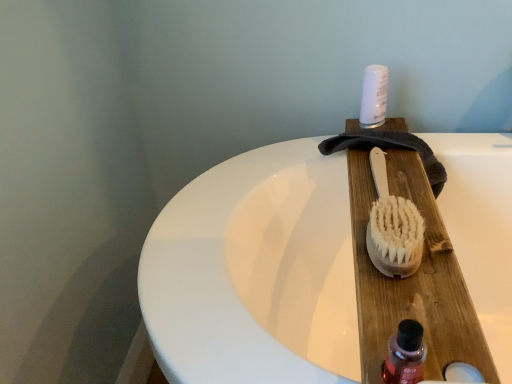
Question: Is white plastic canister at upper center to the left or to the right of natural wood brush at center in the image?

Choices:
 (A) right
 (B) left

Answer: (A)

Question: Is white plastic canister at upper center bigger or smaller than natural wood brush at center?

Choices:
 (A) small
 (B) big

Answer: (A)

Question: Which of these objects is positioned closest to the natural wood brush at center?

Choices:
 (A) white plastic canister at upper center
 (B) translucent plastic bottle at lower right

Answer: (B)

Question: Which object is the closest to the white plastic canister at upper center?

Choices:
 (A) natural wood brush at center
 (B) translucent plastic bottle at lower right

Answer: (A)